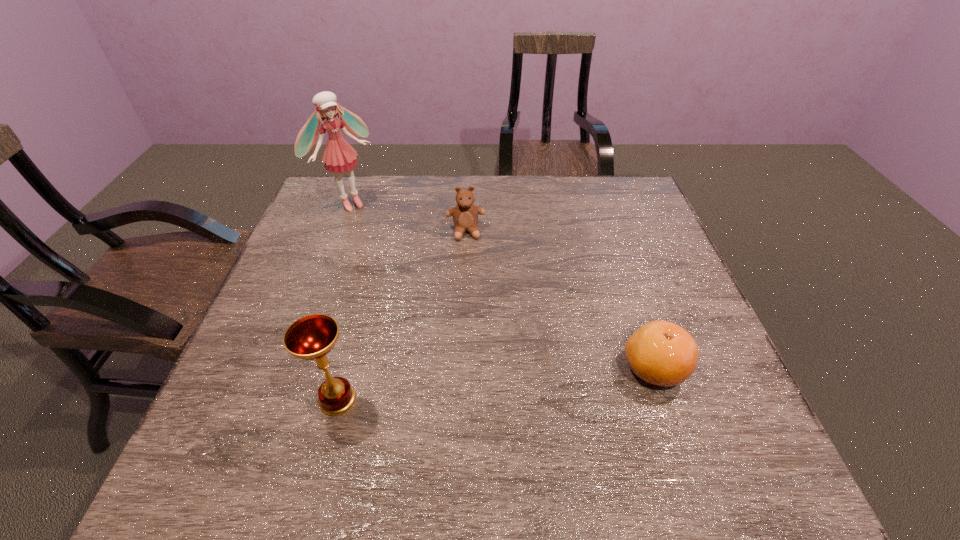
You are a GUI agent. You are given a task and a screenshot of the screen. Output one action in this format:
    pyautogui.click(x=<x>, y=<y>)
    Task: Click on the object that is at the far left corner
    The image size is (960, 540).
    Given the screenshot: What is the action you would take?
    [x=339, y=156]

Find the location of a particular element. This screenshot has width=960, height=540. object situated at the near right corner is located at coordinates (661, 353).

Locate an element on the screen. The height and width of the screenshot is (540, 960). free location at the far edge of the desktop is located at coordinates (574, 180).

Identify the location of free region at the near edge. (428, 429).

The height and width of the screenshot is (540, 960). What are the coordinates of `free space at the left edge` in the screenshot? It's located at (313, 247).

Locate an element on the screen. This screenshot has height=540, width=960. free space at the right edge of the desktop is located at coordinates (650, 292).

This screenshot has width=960, height=540. In the image, there is a desktop. What are the coordinates of `free region at the far left corner` in the screenshot? It's located at (336, 197).

Where is `vacant space at the near right corner`? vacant space at the near right corner is located at coordinates (672, 413).

Image resolution: width=960 pixels, height=540 pixels. Identify the location of vacant space that's between the rightmost object and the farthest object. (501, 285).

The image size is (960, 540). I want to click on free spot between the tallest object and the second object from right to left, so click(x=407, y=217).